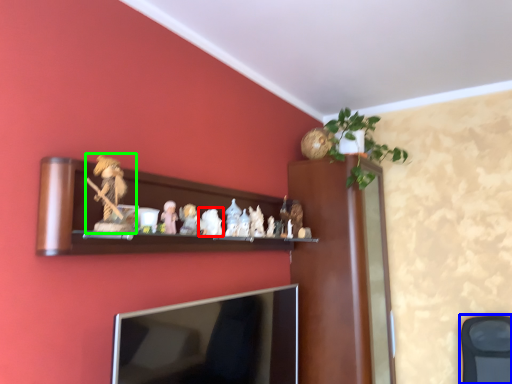
Question: Based on their relative distances, which object is farther from toy (highlighted by a red box)? Choose from swivel chair (highlighted by a blue box) and toy (highlighted by a green box).

Choices:
 (A) swivel chair
 (B) toy

Answer: (A)